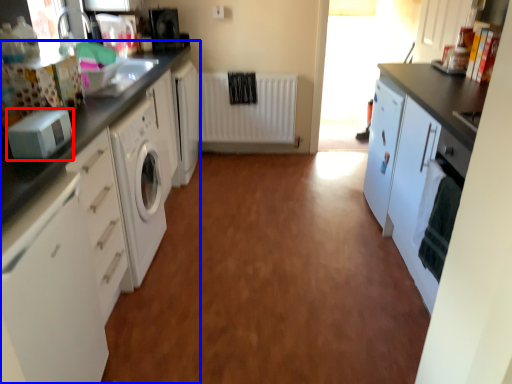
Question: Which object appears farthest to the camera in this image, appliance (highlighted by a red box) or cabinetry (highlighted by a blue box)?

Choices:
 (A) appliance
 (B) cabinetry

Answer: (B)